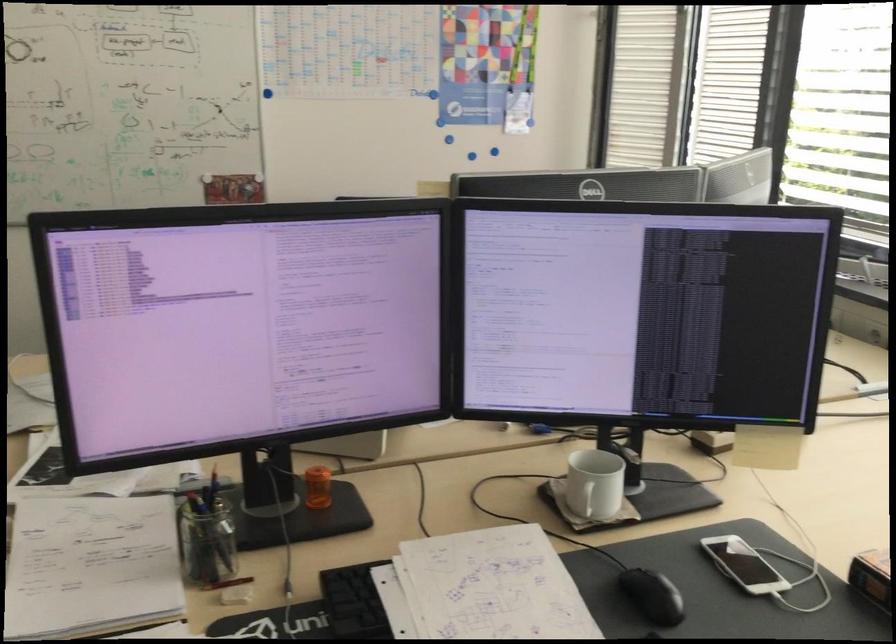
Which object does [317,487] point to?

This point indicates the orange pill bottle.